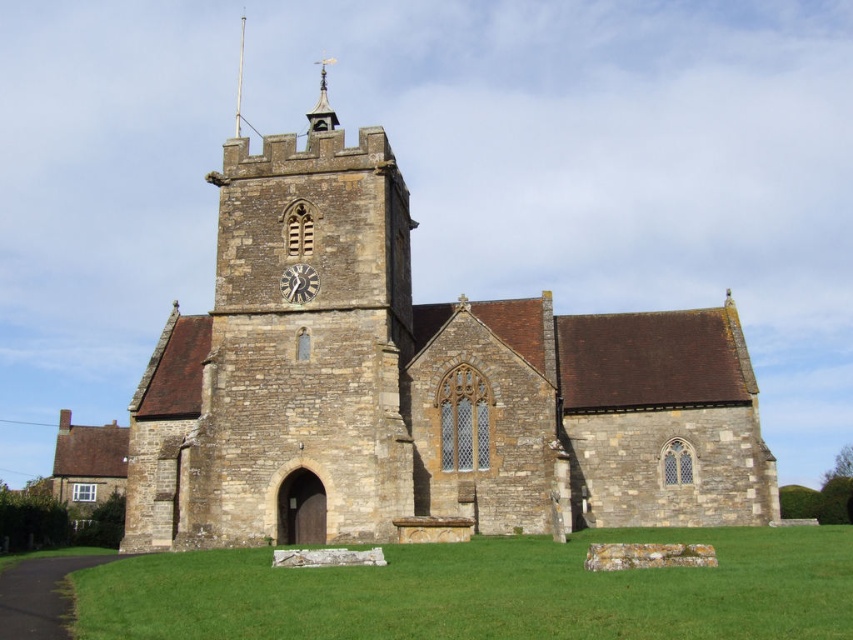
Can you confirm if stone spire at upper center is shorter than smooth silver spire at upper center?

In fact, stone spire at upper center may be taller than smooth silver spire at upper center.

Which is more to the left, stone spire at upper center or smooth silver spire at upper center?

smooth silver spire at upper center is more to the left.

Where is `stone spire at upper center`? The height and width of the screenshot is (640, 853). stone spire at upper center is located at coordinates (321, 106).

The height and width of the screenshot is (640, 853). I want to click on stone spire at upper center, so click(321, 106).

Is point (302, 300) farther from viewer compared to point (326, 93)?

No.

Between point (306, 284) and point (323, 102), which one is positioned behind?

The point (323, 102) is more distant.

Find the location of a particular element. The image size is (853, 640). dark gray stone clock at center is located at coordinates (299, 284).

Which is more to the left, brown stone church at center or smooth silver spire at upper center?

From the viewer's perspective, smooth silver spire at upper center appears more on the left side.

Which is behind, point (326, 134) or point (241, 45)?

The point (241, 45) is behind.

Is point (151, 525) positioned before point (239, 129)?

Yes, point (151, 525) is in front of point (239, 129).

This screenshot has height=640, width=853. In order to click on brown stone church at center in this screenshot , I will do `click(418, 387)`.